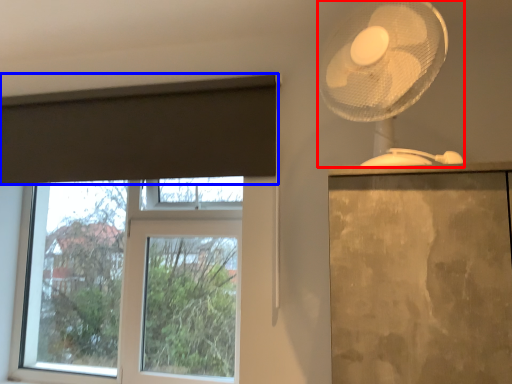
Question: Which object is further to the camera taking this photo, mechanical fan (highlighted by a red box) or curtain (highlighted by a blue box)?

Choices:
 (A) mechanical fan
 (B) curtain

Answer: (B)